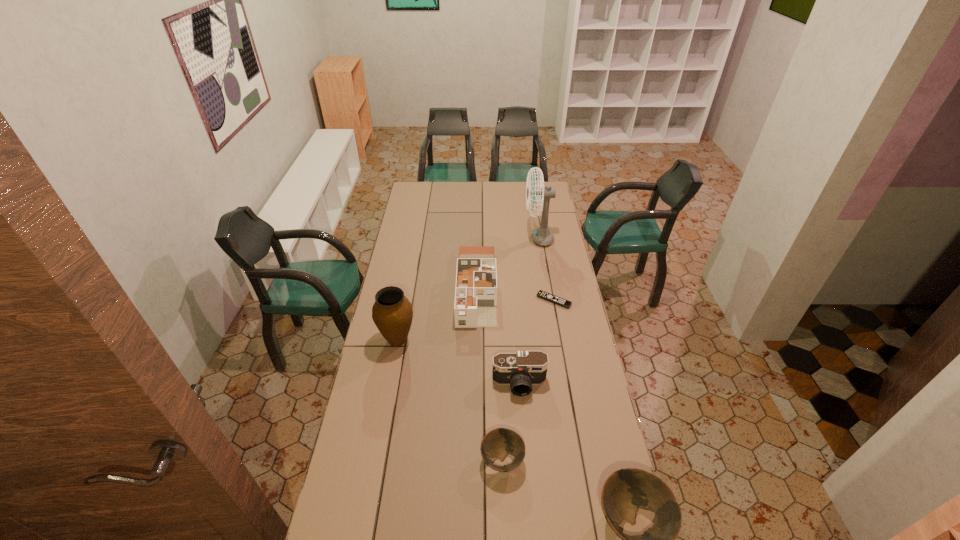
Where is `the sixth farthest object`? This screenshot has width=960, height=540. the sixth farthest object is located at coordinates (500, 442).

Where is `the shorter bowl`? the shorter bowl is located at coordinates (500, 442).

Image resolution: width=960 pixels, height=540 pixels. Find the location of `dollhouse`. dollhouse is located at coordinates (475, 303).

Where is `remote control`? The height and width of the screenshot is (540, 960). remote control is located at coordinates (560, 301).

I want to click on fan, so click(542, 235).

The image size is (960, 540). Find the location of `the farthest object`. the farthest object is located at coordinates (542, 235).

Where is `the third nearest object`? The image size is (960, 540). the third nearest object is located at coordinates (521, 370).

Where is `urn`? This screenshot has height=540, width=960. urn is located at coordinates (392, 313).

I want to click on the second tallest object, so click(392, 313).

Identify the location of vacant region located 0.110m on the front of the left bowl. (504, 518).